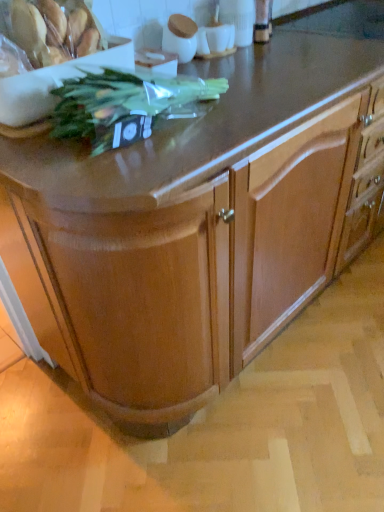
Measure the distance between point (78, 21) and camera.

Point (78, 21) is 36.69 inches from camera.

Describe the element at coordinates (53, 31) in the screenshot. I see `translucent plastic bag of cookies at upper left` at that location.

I want to click on translucent plastic bag of cookies at upper left, so click(x=53, y=31).

In order to face green leafy plant at upper left, should I rotate leftwards or rightwards?

Rotate left and turn 7.311 degrees.

Locate an element on the screen. The height and width of the screenshot is (512, 384). green leafy plant at upper left is located at coordinates (126, 105).

What is the approximate height of green leafy plant at upper left?

5.19 inches.

Image resolution: width=384 pixels, height=512 pixels. Describe the element at coordinates (126, 105) in the screenshot. I see `green leafy plant at upper left` at that location.

You are a GUI agent. You are given a task and a screenshot of the screen. Output one action in this format:
    pyautogui.click(x=<x>, y=<y>)
    Task: Click on the translucent plastic bag of cookies at upper left
    Image resolution: width=384 pixels, height=512 pixels.
    Given the screenshot: What is the action you would take?
    pyautogui.click(x=53, y=31)

Which is more to the left, translucent plastic bag of cookies at upper left or green leafy plant at upper left?

Positioned to the left is translucent plastic bag of cookies at upper left.

Between translucent plastic bag of cookies at upper left and green leafy plant at upper left, which one is positioned behind?

translucent plastic bag of cookies at upper left.

Is point (35, 48) in front of point (121, 142)?

No, (35, 48) is further to viewer.

From the image's perspective, is translucent plastic bag of cookies at upper left above green leafy plant at upper left?

Indeed, from the image's perspective, translucent plastic bag of cookies at upper left is shown above green leafy plant at upper left.

From a real-world perspective, which object rests below the other?

green leafy plant at upper left, from a real-world perspective.

In terms of width, does translucent plastic bag of cookies at upper left look wider or thinner when compared to green leafy plant at upper left?

translucent plastic bag of cookies at upper left is thinner than green leafy plant at upper left.

Which of these two, translucent plastic bag of cookies at upper left or green leafy plant at upper left, stands shorter?

green leafy plant at upper left.

Considering the sizes of objects translucent plastic bag of cookies at upper left and green leafy plant at upper left in the image provided, who is bigger, translucent plastic bag of cookies at upper left or green leafy plant at upper left?

With larger size is green leafy plant at upper left.

Do you think translucent plastic bag of cookies at upper left is within green leafy plant at upper left, or outside of it?

translucent plastic bag of cookies at upper left is outside green leafy plant at upper left.

Is translucent plastic bag of cookies at upper left placed right next to green leafy plant at upper left?

translucent plastic bag of cookies at upper left and green leafy plant at upper left are clearly separated.

Is translucent plastic bag of cookies at upper left facing towards green leafy plant at upper left?

Yes, translucent plastic bag of cookies at upper left faces towards green leafy plant at upper left.

Can you tell me how much translucent plastic bag of cookies at upper left and green leafy plant at upper left differ in facing direction?

1 degrees separate the facing orientations of translucent plastic bag of cookies at upper left and green leafy plant at upper left.

How far apart are translucent plastic bag of cookies at upper left and green leafy plant at upper left?

translucent plastic bag of cookies at upper left is 6.86 inches from green leafy plant at upper left.

Where is `plant on the right of translucent plastic bag of cookies at upper left`? Image resolution: width=384 pixels, height=512 pixels. plant on the right of translucent plastic bag of cookies at upper left is located at coordinates (126, 105).

Considering the positions of objects green leafy plant at upper left and translucent plastic bag of cookies at upper left in the image provided, who is more to the left, green leafy plant at upper left or translucent plastic bag of cookies at upper left?

Positioned to the left is translucent plastic bag of cookies at upper left.

In the image, is green leafy plant at upper left positioned in front of or behind translucent plastic bag of cookies at upper left?

Visually, green leafy plant at upper left is located in front of translucent plastic bag of cookies at upper left.

Considering the positions of point (130, 119) and point (80, 13), is point (130, 119) closer or farther from the camera than point (80, 13)?

Point (130, 119) is positioned closer to the camera compared to point (80, 13).

From the image's perspective, does green leafy plant at upper left appear higher than translucent plastic bag of cookies at upper left?

No.

From a real-world perspective, is green leafy plant at upper left beneath translucent plastic bag of cookies at upper left?

Correct, in the physical world, green leafy plant at upper left is lower than translucent plastic bag of cookies at upper left.

Looking at this image, which object is thinner, green leafy plant at upper left or translucent plastic bag of cookies at upper left?

Thinner between the two is translucent plastic bag of cookies at upper left.

Considering the relative sizes of green leafy plant at upper left and translucent plastic bag of cookies at upper left in the image provided, is green leafy plant at upper left shorter than translucent plastic bag of cookies at upper left?

Yes, green leafy plant at upper left is shorter than translucent plastic bag of cookies at upper left.

Can you confirm if green leafy plant at upper left is smaller than translucent plastic bag of cookies at upper left?

Incorrect, green leafy plant at upper left is not smaller in size than translucent plastic bag of cookies at upper left.

In the scene shown: Choose the correct answer: Is green leafy plant at upper left inside translucent plastic bag of cookies at upper left or outside it?

green leafy plant at upper left is not enclosed by translucent plastic bag of cookies at upper left.

Are green leafy plant at upper left and translucent plastic bag of cookies at upper left located far from each other?

No, green leafy plant at upper left is not far from translucent plastic bag of cookies at upper left.

Is green leafy plant at upper left facing towards translucent plastic bag of cookies at upper left?

No, green leafy plant at upper left does not turn towards translucent plastic bag of cookies at upper left.

What's the angular difference between green leafy plant at upper left and translucent plastic bag of cookies at upper left's facing directions?

The angular difference between green leafy plant at upper left and translucent plastic bag of cookies at upper left is 1 degrees.

Locate an element on the screen. This screenshot has width=384, height=512. food lying on the left of green leafy plant at upper left is located at coordinates (53, 31).

Find the location of a particular element. plant below the translucent plastic bag of cookies at upper left (from the image's perspective) is located at coordinates (126, 105).

This screenshot has height=512, width=384. I want to click on plant on the right of translucent plastic bag of cookies at upper left, so click(x=126, y=105).